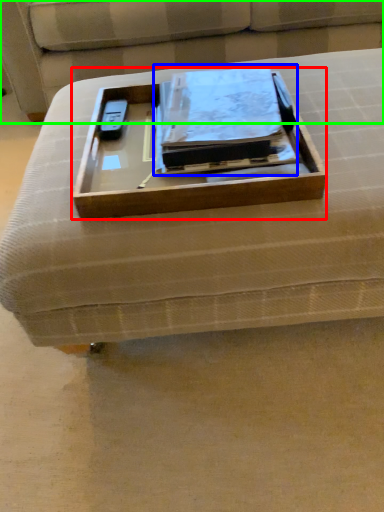
Question: Which is farther away from box (highlighted by a red box)? binder (highlighted by a blue box) or couch (highlighted by a green box)?

Choices:
 (A) binder
 (B) couch

Answer: (B)